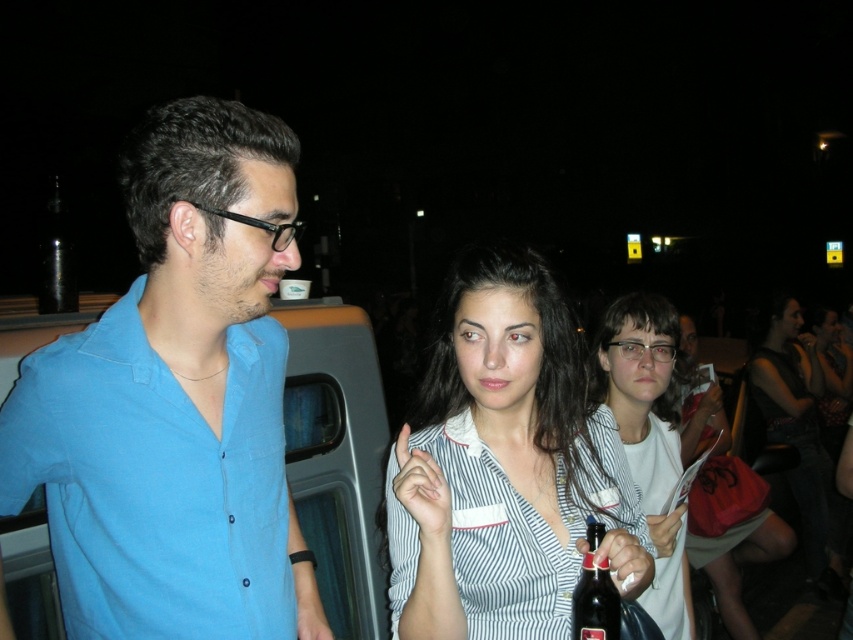
Who is more forward, (415, 600) or (659, 385)?

Point (415, 600) is more forward.

Who is positioned more to the left, striped fabric shirt at center or white matte shirt at center?

striped fabric shirt at center is more to the left.

Between point (532, 611) and point (683, 556), which one is positioned in front?

Point (532, 611)

Where is `striped fabric shirt at center`? striped fabric shirt at center is located at coordinates (505, 465).

Who is positioned more to the right, blue cotton shirt at left or dark glass bottle at center?

dark glass bottle at center

Does blue cotton shirt at left have a greater height compared to dark glass bottle at center?

Indeed, blue cotton shirt at left has a greater height compared to dark glass bottle at center.

Which is behind, point (61, 547) or point (576, 627)?

Point (61, 547)

Locate an element on the screen. The image size is (853, 640). blue cotton shirt at left is located at coordinates (177, 401).

Who is lower down, striped fabric shirt at center or transparent glass bottle at upper left?

striped fabric shirt at center is lower down.

Does point (625, 464) lie in front of point (68, 282)?

Yes, it is in front of point (68, 282).

Is point (488, 264) behind point (44, 291)?

No, (488, 264) is in front of (44, 291).

This screenshot has height=640, width=853. I want to click on striped fabric shirt at center, so click(505, 465).